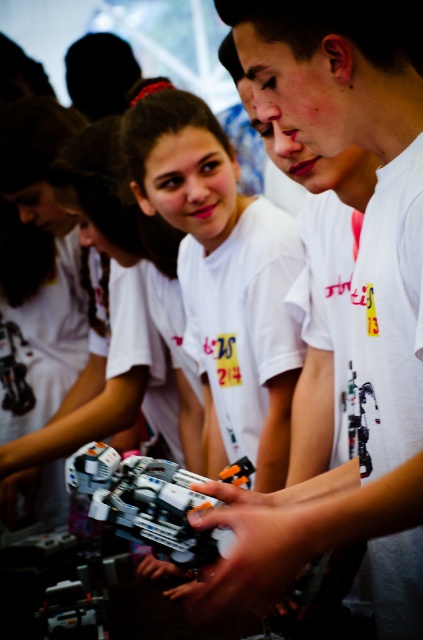
Is point (162, 163) positioned in front of point (112, 381)?

Yes, point (162, 163) is closer to viewer.

The image size is (423, 640). I want to click on white matte t-shirt at upper center, so click(x=220, y=272).

Identify the location of white matte t-shirt at upper center. This screenshot has height=640, width=423. (220, 272).

Which of these two, white matte robot at center or plastic toy car at center, stands taller?

white matte robot at center is taller.

Based on the photo, who is lower down, white matte robot at center or plastic toy car at center?

Positioned lower is plastic toy car at center.

Measure the distance between white matte robot at center and camera.

30.99 inches

The height and width of the screenshot is (640, 423). What are the coordinates of `white matte robot at center` in the screenshot? It's located at (351, 300).

Between matte white robot at center and plastic toy car at center, which one is positioned lower?

plastic toy car at center is lower down.

Measure the distance between matte white robot at center and plastic toy car at center.

matte white robot at center and plastic toy car at center are 38.55 inches apart from each other.

Is point (73, 442) positioned behind point (167, 483)?

Yes, it is.

Where is `matte white robot at center`? Image resolution: width=423 pixels, height=640 pixels. matte white robot at center is located at coordinates (109, 301).